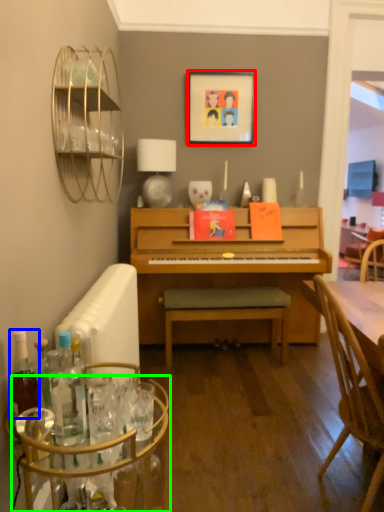
Question: Which is nearer to the picture frame (highlighted by a red box)? bottle (highlighted by a blue box) or glass table (highlighted by a green box).

Choices:
 (A) bottle
 (B) glass table

Answer: (B)